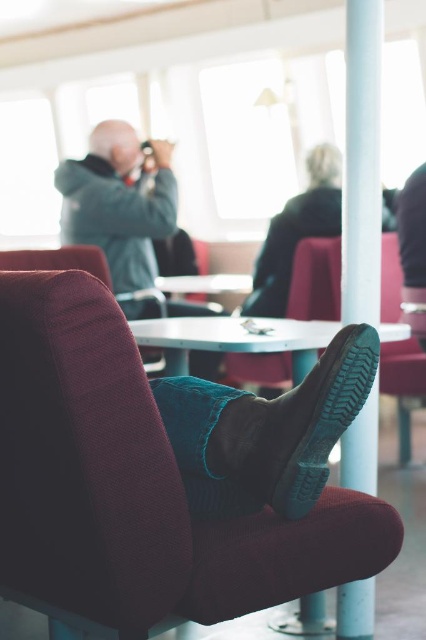
Question: Does leather boot at lower center have a larger size compared to white glossy table at center?

Choices:
 (A) yes
 (B) no

Answer: (B)

Question: Estimate the real-world distances between objects in this image. Which object is farther from the white glossy table at center?

Choices:
 (A) matte gray jacket at upper left
 (B) velvet-like maroon chair at lower left

Answer: (A)

Question: Is velvet-like maroon chair at lower left smaller than white glossy pole at center?

Choices:
 (A) yes
 (B) no

Answer: (B)

Question: Which of the following is the farthest from the observer?

Choices:
 (A) 374,468
 (B) 155,458

Answer: (A)

Question: Which of these objects is positioned farthest from the white glossy table at center?

Choices:
 (A) velvet-like maroon chair at lower left
 (B) matte gray jacket at upper left
 (C) leather boot at lower center
 (D) white glossy pole at center

Answer: (B)

Question: Can you confirm if matte gray jacket at upper left is wider than white glossy table at center?

Choices:
 (A) no
 (B) yes

Answer: (A)